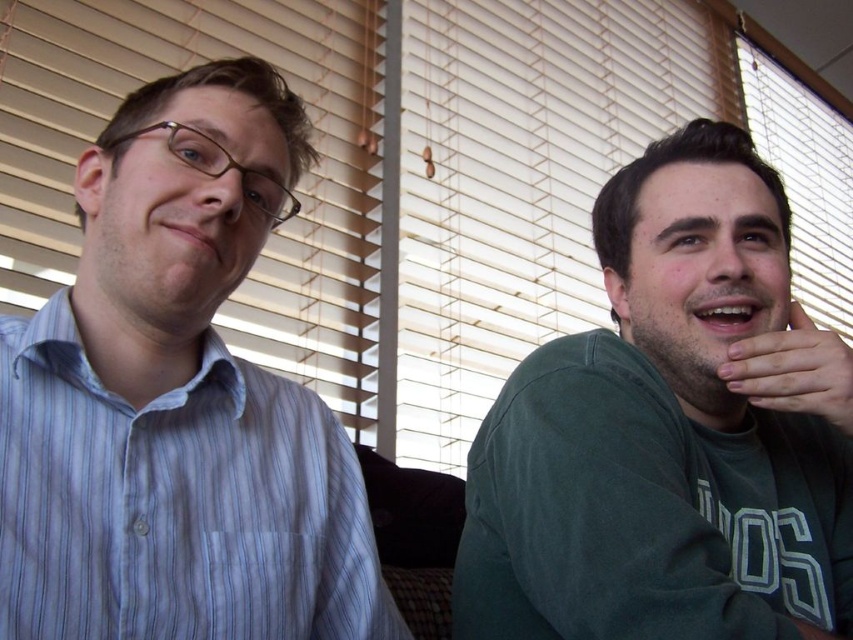
You are designing a new room layout and need to place the green matte shirt at right and the matte wood blinds at center. Given their thickness, which object would require more space when placed side by side?

The matte wood blinds at center are thicker than the green matte shirt at right, so they would require more space when placed side by side.

You are a photographer setting up a shoot in this room. You notice the blue striped shirt at left and the matte skin hand at right. Based on their positions, which object is closer to the camera?

The blue striped shirt at left is below the matte skin hand at right, so the matte skin hand at right is closer to the camera.